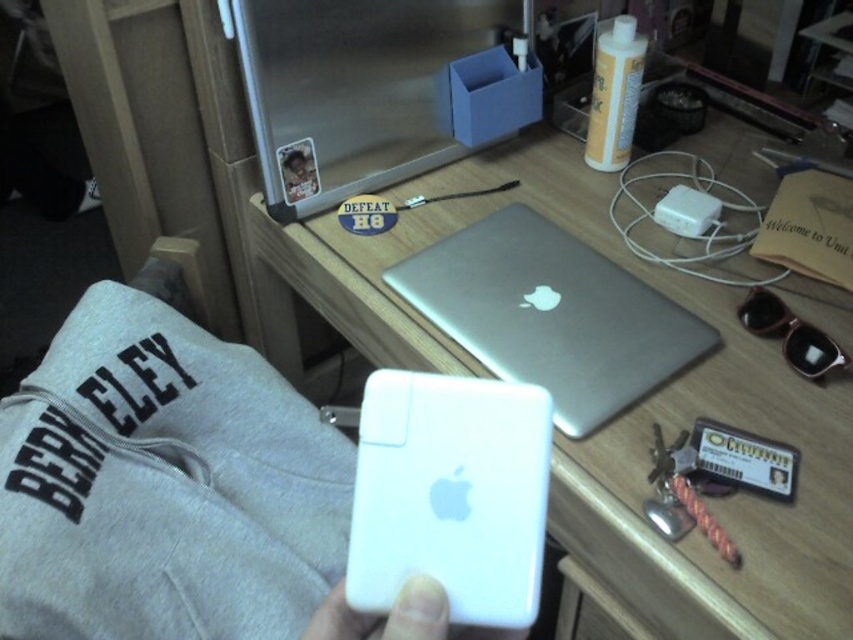
Does point (541, 449) come behind point (412, 582)?

Yes, it is.

Consider the image. Is white plastic ipod at center to the right of white matte phone at center from the viewer's perspective?

Correct, you'll find white plastic ipod at center to the right of white matte phone at center.

Locate an element on the screen. This screenshot has width=853, height=640. white plastic ipod at center is located at coordinates (450, 493).

At what (x,y) coordinates should I click in order to perform the action: click on white plastic ipod at center. Please return your answer as a coordinate pair (x, y). Looking at the image, I should click on (450, 493).

Is wooden desk at center behind white matte phone at center?

Yes, wooden desk at center is further from the viewer.

Which is behind, point (683, 250) or point (402, 592)?

Point (683, 250)

Find the location of a particular element. wooden desk at center is located at coordinates (619, 416).

Which is more to the right, white plastic ipod at center or brushed metal drawer at lower center?

brushed metal drawer at lower center is more to the right.

Does white plastic ipod at center appear over brushed metal drawer at lower center?

Yes, white plastic ipod at center is above brushed metal drawer at lower center.

Describe the element at coordinates (450, 493) in the screenshot. I see `white plastic ipod at center` at that location.

Locate an element on the screen. This screenshot has height=640, width=853. white plastic ipod at center is located at coordinates (450, 493).